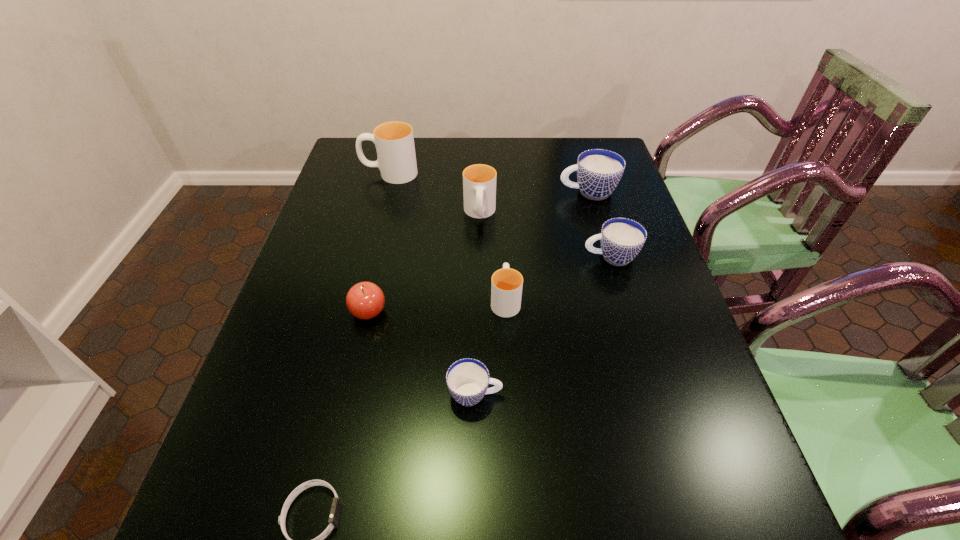
Locate an element on the screen. The width and height of the screenshot is (960, 540). the sixth closest object to the second smallest blue cup is located at coordinates pyautogui.click(x=394, y=141).

The width and height of the screenshot is (960, 540). Find the location of `object that is the fifth closest to the tallest cup`. object that is the fifth closest to the tallest cup is located at coordinates (621, 239).

Identify which cup is located as the nearest to the apple. Please provide its 2D coordinates. Your answer should be formatted as a tuple, i.e. [(x, y)], where the tuple contains the x and y coordinates of a point satisfying the conditions above.

[(467, 379)]

I want to click on cup that stands as the fourth closest to the fourth farthest object, so click(467, 379).

Where is `yellow cup that is the closest one to the second farthest yellow cup`? Image resolution: width=960 pixels, height=540 pixels. yellow cup that is the closest one to the second farthest yellow cup is located at coordinates (394, 141).

Where is `yellow cup identified as the second closest to the biggest blue cup`? yellow cup identified as the second closest to the biggest blue cup is located at coordinates (506, 286).

Locate which blue cup ranks third in proximity to the leftmost yellow cup. Please provide its 2D coordinates. Your answer should be formatted as a tuple, i.e. [(x, y)], where the tuple contains the x and y coordinates of a point satisfying the conditions above.

[(467, 379)]

You are a GUI agent. You are given a task and a screenshot of the screen. Output one action in this format:
    pyautogui.click(x=<x>, y=<y>)
    Task: Click on the blue cup that is the third closest to the second farthest yellow cup
    This screenshot has width=960, height=540.
    Given the screenshot: What is the action you would take?
    pyautogui.click(x=467, y=379)

Identify the location of vacant area in the image that satisfies the following two spatial constraints: 1. on the side of the biggest blue cup with the handle; 2. with the handle on the side of the second biggest yellow cup. Image resolution: width=960 pixels, height=540 pixels. (594, 214).